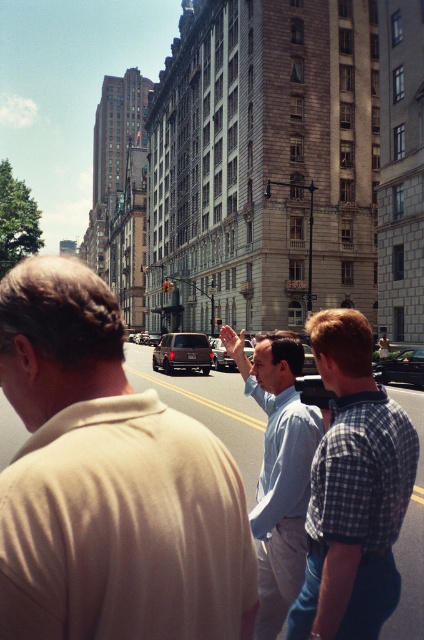
Question: Among these points, which one is farthest from the camera?

Choices:
 (A) (410, 362)
 (B) (320, 448)
 (C) (251, 348)
 (D) (206, 339)

Answer: (C)

Question: Which of the following is the closest to the observer?

Choices:
 (A) shiny black sedan at center
 (B) metallic silver car at center

Answer: (B)

Question: Which of the following is the closest to the observer?

Choices:
 (A) dark brown leather suv at center
 (B) light blue shirt at center
 (C) shiny black sedan at center
 (D) blue plaid shirt at center

Answer: (D)

Question: Can you confirm if beige cotton shirt at center is positioned below metallic silver car at center?

Choices:
 (A) yes
 (B) no

Answer: (B)

Question: Does dark brown leather suv at center have a smaller size compared to shiny black sedan at center?

Choices:
 (A) no
 (B) yes

Answer: (A)

Question: Does beige cotton shirt at center lie in front of blue plaid shirt at center?

Choices:
 (A) yes
 (B) no

Answer: (A)